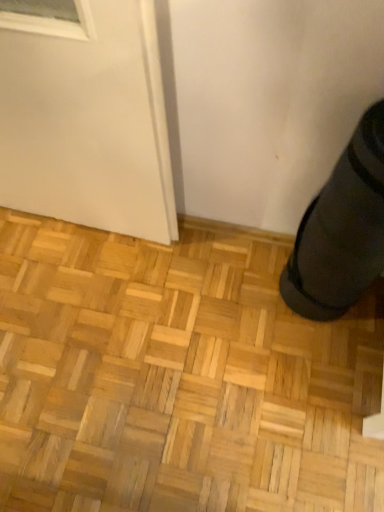
You are a GUI agent. You are given a task and a screenshot of the screen. Output one action in this format:
    pyautogui.click(x=<x>, y=<y>)
    Task: Click on the vacant space to the left of black rubber shoe at lower right
    The image size is (384, 512).
    Given the screenshot: What is the action you would take?
    pyautogui.click(x=251, y=291)